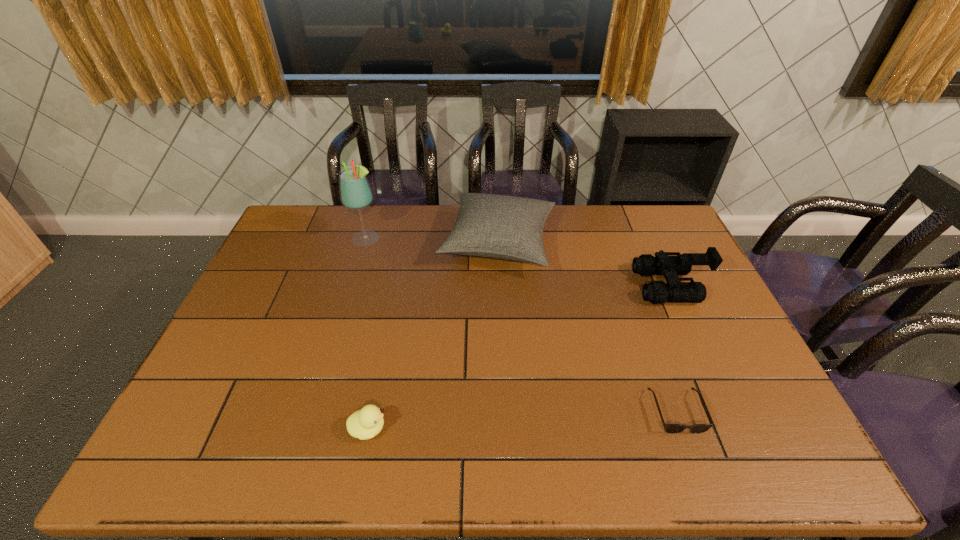
You are a GUI agent. You are given a task and a screenshot of the screen. Output one action in this format:
    pyautogui.click(x=<x>, y=<y>)
    Task: Click on the vacant space located 0.060m on the front lenses of the binoculars
    Image resolution: width=960 pixels, height=540 pixels.
    Given the screenshot: What is the action you would take?
    pyautogui.click(x=618, y=286)

Where is `vacant space located on the front lenses of the binoculars`? vacant space located on the front lenses of the binoculars is located at coordinates (575, 286).

The image size is (960, 540). In order to click on free space located at the beak of the duckling in this screenshot , I will do `click(543, 428)`.

Identify the location of alcohol that is positioned at the far edge. (355, 192).

I want to click on cushion at the far edge, so click(x=504, y=227).

This screenshot has height=540, width=960. I want to click on duckling that is at the near edge, so click(366, 423).

This screenshot has width=960, height=540. Identify the location of sunglasses at the near edge. pyautogui.click(x=669, y=428).

Identify the location of object that is at the right edge. (674, 291).

This screenshot has width=960, height=540. I want to click on free location at the far edge of the desktop, so click(444, 205).

This screenshot has width=960, height=540. I want to click on blank space at the near edge of the desktop, so click(492, 446).